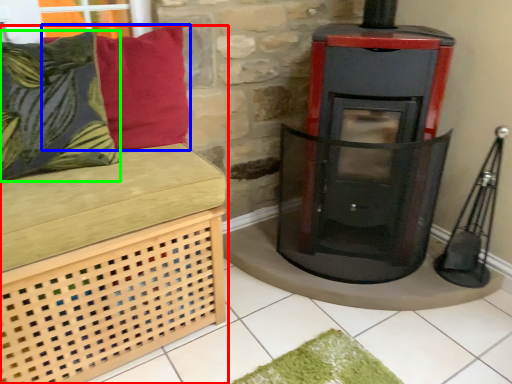
Question: Which object is the closest to the furniture (highlighted by a red box)? Choose among these: pillow (highlighted by a blue box) or pillow (highlighted by a green box).

Choices:
 (A) pillow
 (B) pillow

Answer: (B)